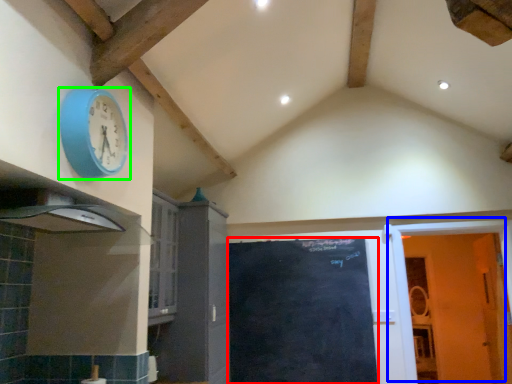
Question: Estimate the real-world distances between objects in this image. Which object is closer to door (highlighted by a red box), door (highlighted by a blue box) or wall clock (highlighted by a green box)?

Choices:
 (A) door
 (B) wall clock

Answer: (A)